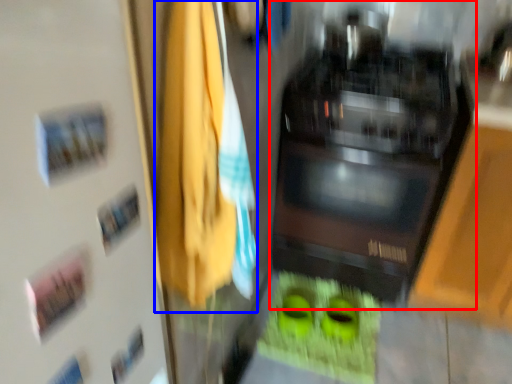
Question: Among these objects, which one is nearest to the camera, home appliance (highlighted by a red box) or laundry (highlighted by a blue box)?

Choices:
 (A) home appliance
 (B) laundry

Answer: (B)